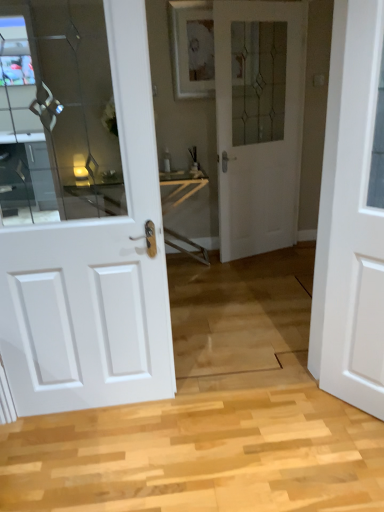
Describe the element at coordinates (351, 218) in the screenshot. I see `white matte door at right, marked as the third door in a back-to-front arrangement` at that location.

Find the location of a particular element. Image resolution: width=384 pixels, height=512 pixels. white glossy door at left, the first door viewed from the left is located at coordinates (100, 262).

Do you think white glass door at center, the 1th door when ordered from back to front, is within white glossy door at left, the first door viewed from the left, or outside of it?

white glass door at center, the 1th door when ordered from back to front, is not enclosed by white glossy door at left, the first door viewed from the left.

From the picture: From the image's perspective, which one is positioned lower, white glass door at center, the second door in the right-to-left sequence, or white glossy door at left, positioned as the second door in front-to-back order?

From the image's view, white glossy door at left, positioned as the second door in front-to-back order, is below.

From the picture: Measure the distance between white glass door at center, the third door positioned from the front, and white glossy door at left, placed as the 2th door when sorted from back to front.

A distance of 6.22 feet exists between white glass door at center, the third door positioned from the front, and white glossy door at left, placed as the 2th door when sorted from back to front.

Consider the image. Is white glass door at center, which ranks as the 2th door in left-to-right order, aimed at white glossy door at left, placed as the 2th door when sorted from back to front?

No, white glass door at center, which ranks as the 2th door in left-to-right order, is not facing towards white glossy door at left, placed as the 2th door when sorted from back to front.

Does white matte door at right, marked as the 3th door in a left-to-right arrangement, turn towards white glossy door at left, the first door viewed from the left?

No.

From the picture: Considering the sizes of objects white matte door at right, placed as the 1th door when sorted from front to back, and white glossy door at left, positioned as the second door in front-to-back order, in the image provided, who is smaller, white matte door at right, placed as the 1th door when sorted from front to back, or white glossy door at left, positioned as the second door in front-to-back order,?

white matte door at right, placed as the 1th door when sorted from front to back.

Which is in front, white matte door at right, placed as the 1th door when sorted from front to back, or white glossy door at left, which appears as the 3th door when viewed from the right?

white matte door at right, placed as the 1th door when sorted from front to back, is more forward.

You are a GUI agent. You are given a task and a screenshot of the screen. Output one action in this format:
    pyautogui.click(x=<x>, y=<y>)
    Task: Click on the 1st door directly above the white matte door at right, marked as the first door in a right-to-left arrangement (from a real-world perspective)
    Image resolution: width=384 pixels, height=512 pixels.
    Given the screenshot: What is the action you would take?
    pyautogui.click(x=100, y=262)

Is white glossy door at left, the first door viewed from the left, positioned far away from white glass door at center, which ranks as the 2th door in left-to-right order?

That's right, there is a large distance between white glossy door at left, the first door viewed from the left, and white glass door at center, which ranks as the 2th door in left-to-right order.

Considering the relative sizes of white glossy door at left, the first door viewed from the left, and white glass door at center, which ranks as the 2th door in left-to-right order, in the image provided, is white glossy door at left, the first door viewed from the left, smaller than white glass door at center, which ranks as the 2th door in left-to-right order,?

Yes.

Is point (24, 386) behind point (298, 181)?

No, (24, 386) is closer to viewer.

Consider the image. From the image's perspective, between white glass door at center, which ranks as the 2th door in left-to-right order, and white matte door at right, marked as the third door in a back-to-front arrangement, which one is located above?

white glass door at center, which ranks as the 2th door in left-to-right order.

From a real-world perspective, which is physically above, white glass door at center, the third door positioned from the front, or white matte door at right, marked as the third door in a back-to-front arrangement?

white glass door at center, the third door positioned from the front, is physically above.

Locate an element on the screen. The height and width of the screenshot is (512, 384). the 2nd door positioned above the white matte door at right, marked as the third door in a back-to-front arrangement (from a real-world perspective) is located at coordinates (261, 142).

Measure the distance between white glass door at center, the third door positioned from the front, and white matte door at right, marked as the 3th door in a left-to-right arrangement.

1.75 meters.

Considering the relative sizes of white matte door at right, marked as the 3th door in a left-to-right arrangement, and white glass door at center, the third door positioned from the front, in the image provided, is white matte door at right, marked as the 3th door in a left-to-right arrangement, taller than white glass door at center, the third door positioned from the front,?

No.

Which is closer to the camera, (336, 261) or (279, 154)?

Point (336, 261).

At what (x,y) coordinates should I click in order to perform the action: click on door to the right of white glass door at center, which ranks as the 2th door in left-to-right order. Please return your answer as a coordinate pair (x, y). The width and height of the screenshot is (384, 512). Looking at the image, I should click on (351, 218).

Between white matte door at right, marked as the first door in a right-to-left arrangement, and white glass door at center, the 1th door when ordered from back to front, which one is positioned behind?

white glass door at center, the 1th door when ordered from back to front, is further away from the camera.

I want to click on the 1st door above the white matte door at right, marked as the third door in a back-to-front arrangement (from the image's perspective), so click(x=100, y=262).

From a real-world perspective, is white glossy door at left, which appears as the 3th door when viewed from the right, located higher than white matte door at right, marked as the first door in a right-to-left arrangement?

Yes, from a real-world perspective, white glossy door at left, which appears as the 3th door when viewed from the right, is on top of white matte door at right, marked as the first door in a right-to-left arrangement.

Which object is further away from the camera, white glossy door at left, placed as the 2th door when sorted from back to front, or white matte door at right, placed as the 1th door when sorted from front to back?

white glossy door at left, placed as the 2th door when sorted from back to front.

Which door is the 1st one when counting from the front of the white glass door at center, the second door in the right-to-left sequence? Please provide its 2D coordinates.

[(100, 262)]

Identify the location of the 1st door above the white matte door at right, marked as the 3th door in a left-to-right arrangement (from a real-world perspective). (100, 262).

When comparing their distances from white matte door at right, placed as the 1th door when sorted from front to back, does white glass door at center, the 1th door when ordered from back to front, or white glossy door at left, which appears as the 3th door when viewed from the right, seem closer?

white glossy door at left, which appears as the 3th door when viewed from the right, is closer to white matte door at right, placed as the 1th door when sorted from front to back.

In the scene shown: From the image, which object appears to be farther from white glass door at center, the second door in the right-to-left sequence, white matte door at right, placed as the 1th door when sorted from front to back, or white glossy door at left, which appears as the 3th door when viewed from the right?

white glossy door at left, which appears as the 3th door when viewed from the right, is further to white glass door at center, the second door in the right-to-left sequence.

Looking at the image, which one is located closer to white glossy door at left, the first door viewed from the left, white glass door at center, the second door in the right-to-left sequence, or white matte door at right, marked as the 3th door in a left-to-right arrangement?

white matte door at right, marked as the 3th door in a left-to-right arrangement.

When comparing their distances from white glass door at center, which ranks as the 2th door in left-to-right order, does white glossy door at left, the first door viewed from the left, or white matte door at right, placed as the 1th door when sorted from front to back, seem further?

white glossy door at left, the first door viewed from the left, is positioned further to the anchor white glass door at center, which ranks as the 2th door in left-to-right order.

When comparing their distances from white glossy door at left, placed as the 2th door when sorted from back to front, does white matte door at right, placed as the 1th door when sorted from front to back, or white glass door at center, which ranks as the 2th door in left-to-right order, seem further?

Among the two, white glass door at center, which ranks as the 2th door in left-to-right order, is located further to white glossy door at left, placed as the 2th door when sorted from back to front.

Looking at the image, which one is located closer to white matte door at right, placed as the 1th door when sorted from front to back, white glossy door at left, positioned as the second door in front-to-back order, or white glass door at center, the third door positioned from the front?

white glossy door at left, positioned as the second door in front-to-back order, is positioned closer to the anchor white matte door at right, placed as the 1th door when sorted from front to back.

Locate an element on the screen. This screenshot has height=512, width=384. door located between white matte door at right, marked as the first door in a right-to-left arrangement, and white glass door at center, the 1th door when ordered from back to front, in the depth direction is located at coordinates (100, 262).